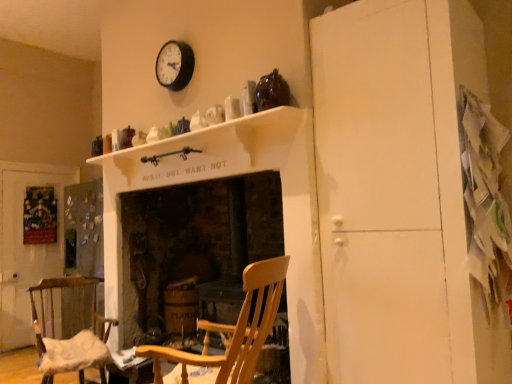
What is the approximate width of wooden fireplace at center?

wooden fireplace at center is 59.53 centimeters wide.

You are a GUI agent. You are given a task and a screenshot of the screen. Output one action in this format:
    pyautogui.click(x=<x>, y=<y>)
    Task: Click on the white paper at lower left
    
    Given the screenshot: What is the action you would take?
    pyautogui.click(x=129, y=365)

What do you see at coordinates (72, 336) in the screenshot? I see `wooden chair with fabric cushion at lower left, the 1th chair when ordered from left to right` at bounding box center [72, 336].

I want to click on white matte cabinet at right, so 399,194.

Is wooden chair with fabric cushion at lower left, the 1th chair when ordered from left to right, inside or outside of matte black clock at upper center?

wooden chair with fabric cushion at lower left, the 1th chair when ordered from left to right, is not enclosed by matte black clock at upper center.

Is wooden chair with fabric cushion at lower left, the 1th chair when ordered from left to right, wider than matte black clock at upper center?

Yes, wooden chair with fabric cushion at lower left, the 1th chair when ordered from left to right, is wider than matte black clock at upper center.

Does point (61, 351) lie behind point (169, 83)?

No.

This screenshot has height=384, width=512. In order to click on dresser above the wooden fireplace at center (from the image's perspective) in this screenshot , I will do `click(399, 194)`.

Which object is positioned more to the left, white matte cabinet at right or wooden fireplace at center?

From the viewer's perspective, wooden fireplace at center appears more on the left side.

From the image's perspective, is white matte cabinet at right located above or below wooden fireplace at center?

white matte cabinet at right is situated higher than wooden fireplace at center in the image.

Considering the relative sizes of white matte cabinet at right and wooden fireplace at center in the image provided, is white matte cabinet at right taller than wooden fireplace at center?

Correct, white matte cabinet at right is much taller as wooden fireplace at center.

Which is closer to the camera, (189, 59) or (113, 152)?

The point (189, 59) is in front.

Locate an element on the screen. This screenshot has width=512, height=384. clock that is on the right side of white matte mantle at upper center is located at coordinates (175, 65).

Looking at their sizes, would you say matte black clock at upper center is wider or thinner than white matte mantle at upper center?

Clearly, matte black clock at upper center has less width compared to white matte mantle at upper center.

From the image's perspective, between matte black clock at upper center and white matte mantle at upper center, which one is located above?

From the image's view, matte black clock at upper center is above.

Who is more distant, matte black clock at upper center or wooden rocking chair at center, marked as the 2th chair in a left-to-right arrangement?

Positioned behind is matte black clock at upper center.

Considering the relative sizes of matte black clock at upper center and wooden rocking chair at center, which is counted as the 1th chair, starting from the right, in the image provided, is matte black clock at upper center taller than wooden rocking chair at center, which is counted as the 1th chair, starting from the right,?

In fact, matte black clock at upper center may be shorter than wooden rocking chair at center, which is counted as the 1th chair, starting from the right.

Consider the image. Can we say matte black clock at upper center lies outside wooden rocking chair at center, which is counted as the 1th chair, starting from the right?

Yes.

From a real-world perspective, is wooden fireplace at center located higher than white matte cabinet at right?

No, from a real-world perspective, wooden fireplace at center is not over white matte cabinet at right

What are the coordinates of `fireplace below the white matte cabinet at right (from a real-world perspective)` in the screenshot? It's located at (194, 246).

Which object is wider, wooden fireplace at center or white matte cabinet at right?

With larger width is white matte cabinet at right.

Does wooden fireplace at center touch white matte cabinet at right?

wooden fireplace at center and white matte cabinet at right are clearly separated.

Which is in front, white matte mantle at upper center or white paper at lower left?

white matte mantle at upper center is in front.

At what (x,y) coordinates should I click in order to perform the action: click on table below the white matte mantle at upper center (from a real-world perspective). Please return your answer as a coordinate pair (x, y). Looking at the image, I should click on (129, 365).

From the image's perspective, is white matte mantle at upper center below white paper at lower left?

Incorrect, from the image's perspective, white matte mantle at upper center is higher than white paper at lower left.

Considering the relative sizes of white matte mantle at upper center and white paper at lower left in the image provided, is white matte mantle at upper center wider than white paper at lower left?

Indeed, white matte mantle at upper center has a greater width compared to white paper at lower left.

Between white matte cabinet at right and matte black clock at upper center, which one appears on the right side from the viewer's perspective?

From the viewer's perspective, white matte cabinet at right appears more on the right side.

Is point (429, 35) positioned after point (163, 48)?

No, (429, 35) is closer to viewer.

Is white matte cabinet at right wider than matte black clock at upper center?

Yes, white matte cabinet at right is wider than matte black clock at upper center.

This screenshot has height=384, width=512. What are the coordinates of `clock above the wooden chair with fabric cushion at lower left, marked as the first chair in a back-to-front arrangement (from a real-world perspective)` in the screenshot? It's located at [175, 65].

At what (x,y) coordinates should I click in order to perform the action: click on fireplace located below the white matte cabinet at right (from the image's perspective). Please return your answer as a coordinate pair (x, y). This screenshot has height=384, width=512. Looking at the image, I should click on (194, 246).

Considering their positions, is wooden fireplace at center positioned further to matte black clock at upper center than white matte mantle at upper center?

Among the two, wooden fireplace at center is located further to matte black clock at upper center.

Which object lies further to the anchor point wooden fireplace at center, white matte mantle at upper center or white paper at lower left?

Among the two, white matte mantle at upper center is located further to wooden fireplace at center.

Which object lies nearer to the anchor point matte black clock at upper center, white matte mantle at upper center or wooden rocking chair at center, marked as the 2th chair in a left-to-right arrangement?

white matte mantle at upper center.

Estimate the real-world distances between objects in this image. Which object is closer to matte black clock at upper center, wooden fireplace at center or wooden chair with fabric cushion at lower left, the 1th chair when ordered from left to right?

Among the two, wooden fireplace at center is located nearer to matte black clock at upper center.

Looking at this image, estimate the real-world distances between objects in this image. Which object is closer to wooden fireplace at center, white matte mantle at upper center or white matte cabinet at right?

white matte mantle at upper center is closer to wooden fireplace at center.

Consider the image. Which object lies further to the anchor point matte black clock at upper center, wooden rocking chair at center, which ranks as the 1th chair in front-to-back order, or white paper at lower left?

white paper at lower left is positioned further to the anchor matte black clock at upper center.

In the scene shown: From the image, which object appears to be nearer to wooden chair with fabric cushion at lower left, marked as the first chair in a back-to-front arrangement, wooden rocking chair at center, which ranks as the 1th chair in front-to-back order, or white matte mantle at upper center?

wooden rocking chair at center, which ranks as the 1th chair in front-to-back order, lies closer to wooden chair with fabric cushion at lower left, marked as the first chair in a back-to-front arrangement, than the other object.

Considering their positions, is matte black clock at upper center positioned further to white matte cabinet at right than white matte mantle at upper center?

matte black clock at upper center is positioned further to the anchor white matte cabinet at right.

The width and height of the screenshot is (512, 384). Find the location of `fireplace between matte black clock at upper center and wooden rocking chair at center, which ranks as the 1th chair in front-to-back order, in the up-down direction`. fireplace between matte black clock at upper center and wooden rocking chair at center, which ranks as the 1th chair in front-to-back order, in the up-down direction is located at coordinates (194, 246).

In order to click on clock between wooden chair with fabric cushion at lower left, the 2th chair from the right, and white matte cabinet at right from left to right in this screenshot , I will do `click(175, 65)`.

This screenshot has height=384, width=512. I want to click on dresser that lies between matte black clock at upper center and white paper at lower left from top to bottom, so click(399, 194).

Where is `fireplace between white matte mantle at upper center and white matte cabinet at right from left to right`? The height and width of the screenshot is (384, 512). fireplace between white matte mantle at upper center and white matte cabinet at right from left to right is located at coordinates (194, 246).